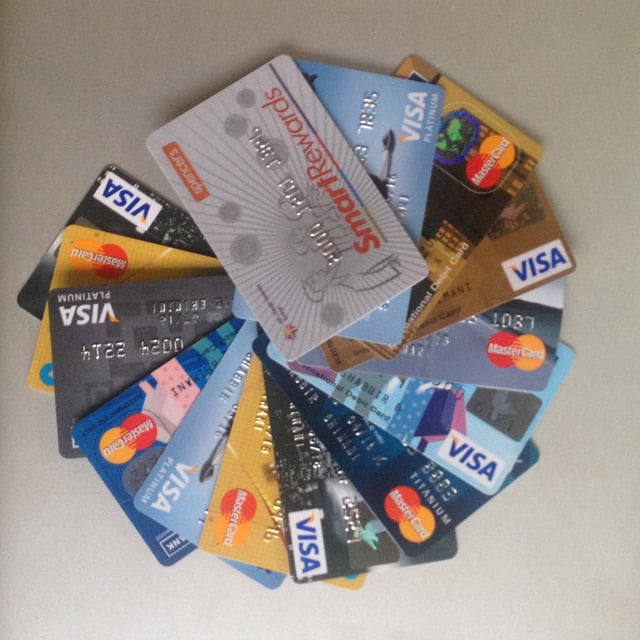
Identify the location of empty table to the bottom left of card. (76, 555).